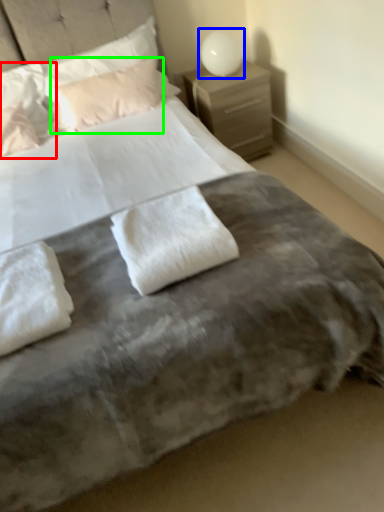
Question: Which object is positioned farthest from pillow (highlighted by a red box)? Select from bedside lamp (highlighted by a blue box) and pillow (highlighted by a green box).

Choices:
 (A) bedside lamp
 (B) pillow

Answer: (A)